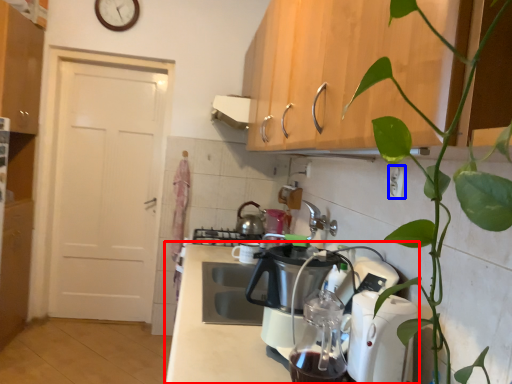
Question: Among these objects, which one is nearest to the camera, countertop (highlighted by a red box) or electric outlet (highlighted by a blue box)?

Choices:
 (A) countertop
 (B) electric outlet

Answer: (A)